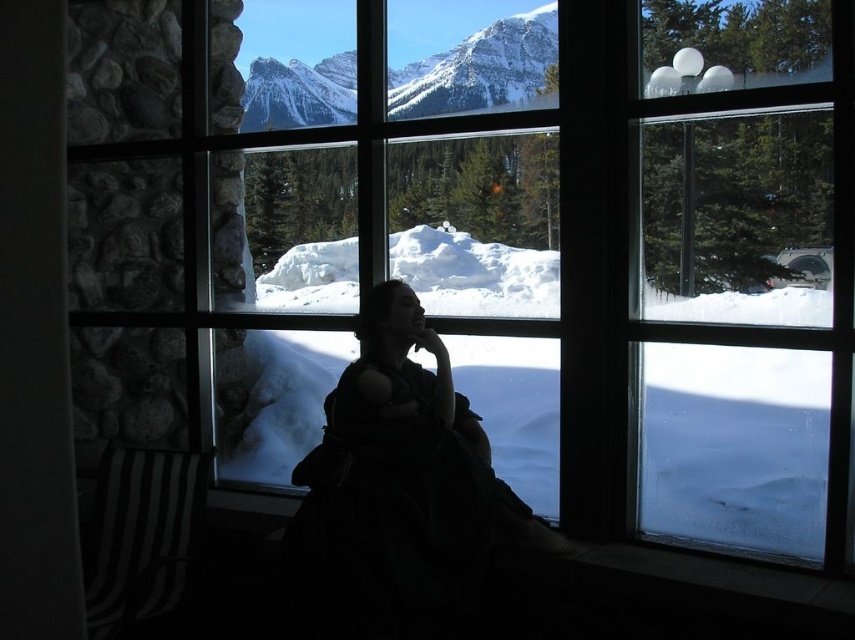
Question: Which of the following is the closest to the observer?

Choices:
 (A) transparent glass window at center
 (B) white fluffy snow at center

Answer: (A)

Question: Does transparent glass window at center have a larger size compared to silhouette dress at center?

Choices:
 (A) no
 (B) yes

Answer: (B)

Question: Can you confirm if transparent glass window at upper right is bigger than silhouette dress at center?

Choices:
 (A) no
 (B) yes

Answer: (A)

Question: Which object appears closest to the camera in this image?

Choices:
 (A) transparent glass window at upper right
 (B) snowy granite mountains at upper left
 (C) transparent glass window at center
 (D) silhouette dress at center

Answer: (A)

Question: Which of the following is the farthest from the observer?

Choices:
 (A) (687, 349)
 (B) (750, 129)
 (C) (374, 541)
 (D) (463, 285)

Answer: (D)

Question: Is silhouette dress at center smaller than snowy granite mountains at upper left?

Choices:
 (A) yes
 (B) no

Answer: (B)